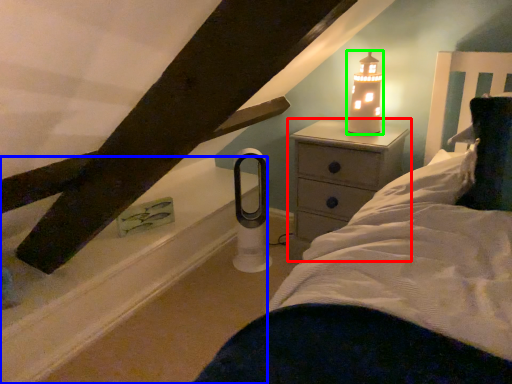
Question: Which object is the farthest from nightstand (highlighted by a red box)? Choose among these: window sill (highlighted by a blue box) or candle holder (highlighted by a green box).

Choices:
 (A) window sill
 (B) candle holder

Answer: (A)